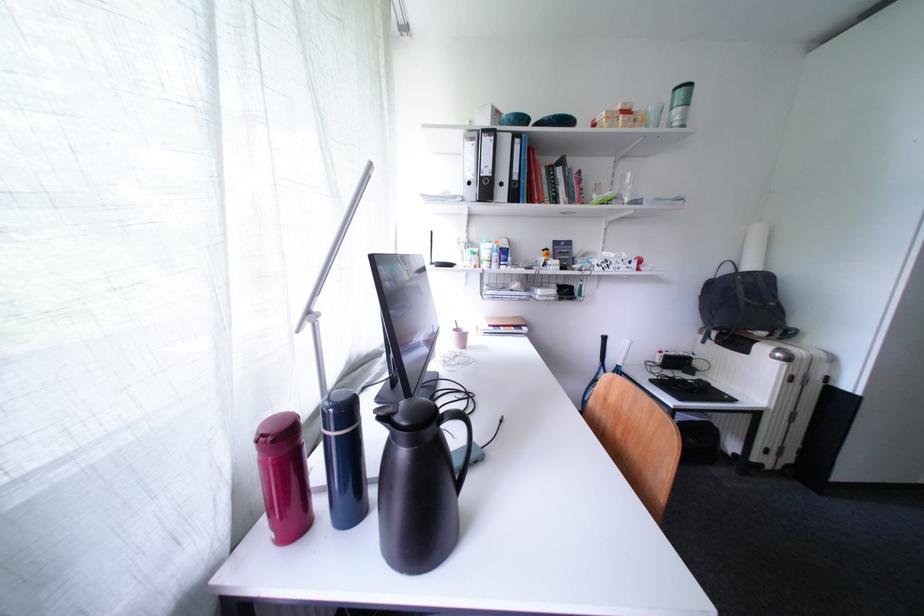
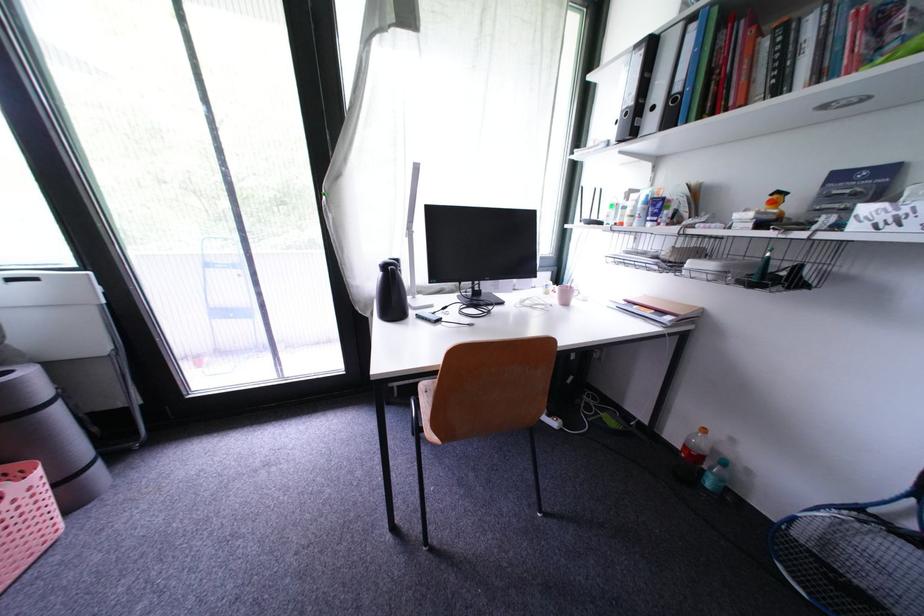
Find the pixel in the second image that matches (x=555, y=257) in the first image.

(782, 206)